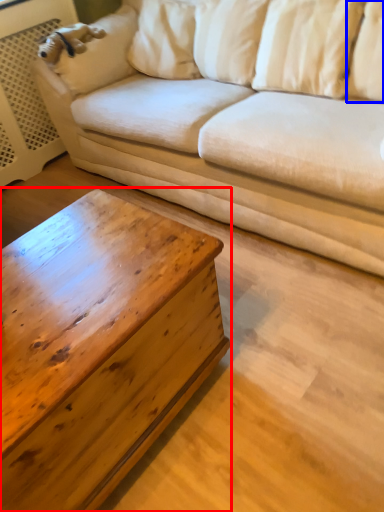
Question: Among these objects, which one is nearest to the camera, coffee table (highlighted by a red box) or pillow (highlighted by a blue box)?

Choices:
 (A) coffee table
 (B) pillow

Answer: (A)